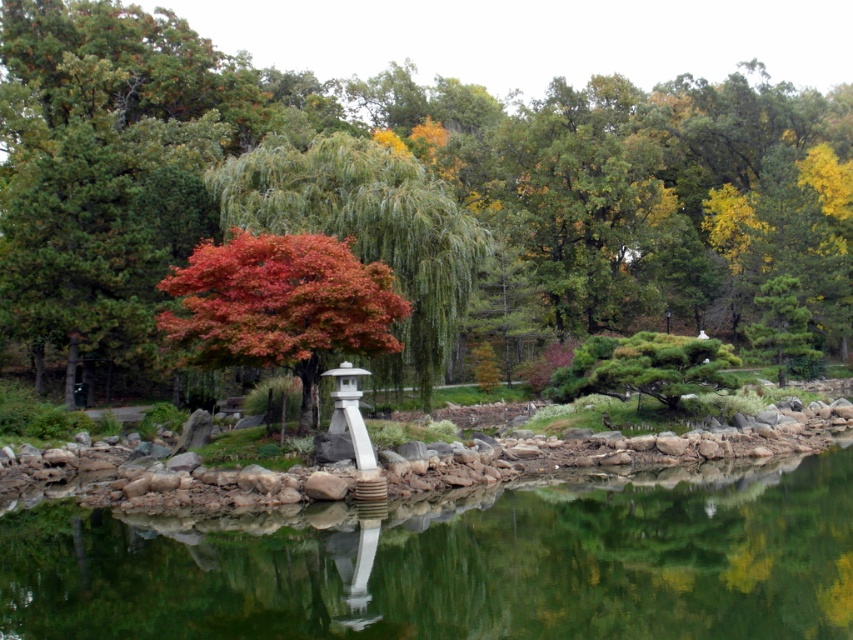
Question: Which point is closer to the camera?

Choices:
 (A) shiny red maple tree at center
 (B) green smooth water at center
 (C) reddish-brown bark tree at center
 (D) reddish-brown wood tree at center

Answer: (B)

Question: Does reddish-brown wood tree at center have a lesser width compared to reddish-brown bark tree at center?

Choices:
 (A) yes
 (B) no

Answer: (B)

Question: Can you confirm if reddish-brown bark tree at center is positioned below shiny red maple tree at center?

Choices:
 (A) yes
 (B) no

Answer: (B)

Question: From the image, what is the correct spatial relationship of reddish-brown bark tree at center in relation to shiny red maple tree at center?

Choices:
 (A) left
 (B) right

Answer: (B)

Question: Which object is positioned closest to the green smooth water at center?

Choices:
 (A) shiny red maple tree at center
 (B) reddish-brown wood tree at center

Answer: (A)

Question: Which of the following is the closest to the observer?

Choices:
 (A) shiny red maple tree at center
 (B) green smooth water at center

Answer: (B)